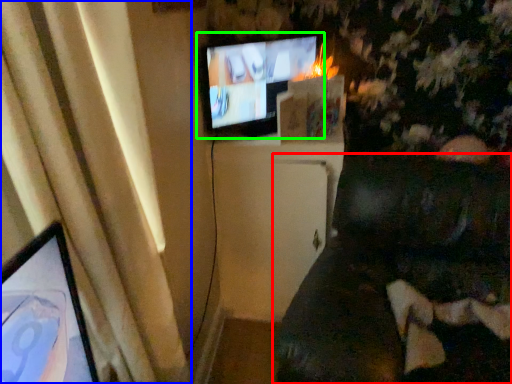
Question: Based on their relative distances, which object is farther from furniture (highlighted by a red box)? Choose from curtain (highlighted by a blue box) and television (highlighted by a green box).

Choices:
 (A) curtain
 (B) television

Answer: (A)